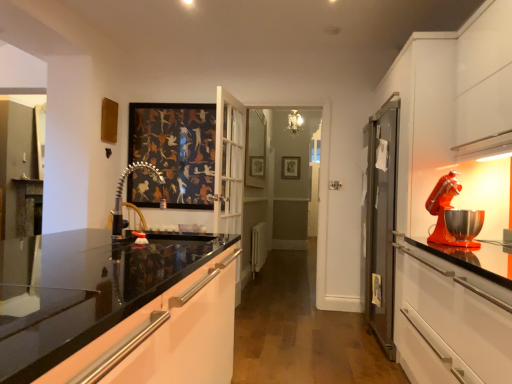
The height and width of the screenshot is (384, 512). Describe the element at coordinates (128, 202) in the screenshot. I see `polished chrome faucet at center` at that location.

Locate an element on the screen. This screenshot has height=384, width=512. white plastic radiator at center is located at coordinates point(258,247).

Find the location of a particular element. This screenshot has height=384, width=512. shiny orange mixer at right is located at coordinates (444, 212).

Between wooden picture frame at center and polished chrome faucet at center, which one has smaller size?

wooden picture frame at center is smaller.

Looking at this image, from the image's perspective, is wooden picture frame at center below polished chrome faucet at center?

No, from the image's perspective, wooden picture frame at center is not below polished chrome faucet at center.

Considering the relative sizes of wooden picture frame at center and polished chrome faucet at center in the image provided, is wooden picture frame at center wider than polished chrome faucet at center?

No.

Is wooden picture frame at center oriented away from polished chrome faucet at center?

wooden picture frame at center is not turned away from polished chrome faucet at center.

Where is `cabinetry that appears below the wooden picture frame at center (from the image's perspective)`? The image size is (512, 384). cabinetry that appears below the wooden picture frame at center (from the image's perspective) is located at coordinates (124, 311).

Which is more distant, (211,302) or (298,165)?

Positioned behind is point (298,165).

Are glossy white cabinet at center and wooden picture frame at center making contact?

No, glossy white cabinet at center is not making contact with wooden picture frame at center.

From the image's perspective, between glossy white cabinet at center and wooden picture frame at center, which one is located above?

wooden picture frame at center, from the image's perspective.

How many degrees apart are the facing directions of polished chrome faucet at center and glossy white cabinet at center?

There is a 0.945-degree angle between the facing directions of polished chrome faucet at center and glossy white cabinet at center.

Does polished chrome faucet at center come in front of glossy white cabinet at center?

No, polished chrome faucet at center is further to the viewer.

Choose the correct answer: Is polished chrome faucet at center inside glossy white cabinet at center or outside it?

The correct answer is: outside.

Which of these two, polished chrome faucet at center or glossy white cabinet at center, is bigger?

glossy white cabinet at center is bigger.

Is the depth of shiny orange mixer at right less than that of white plastic radiator at center?

Yes.

Based on their positions, is shiny orange mixer at right located to the left or right of white plastic radiator at center?

shiny orange mixer at right is positioned on white plastic radiator at center's right side.

Who is bigger, shiny orange mixer at right or white plastic radiator at center?

Bigger between the two is white plastic radiator at center.

How different are the orientations of shiny orange mixer at right and white plastic radiator at center in degrees?

There is a 162-degree angle between the facing directions of shiny orange mixer at right and white plastic radiator at center.

Is the surface of white plastic radiator at center in direct contact with shiny orange mixer at right?

No, white plastic radiator at center is not in contact with shiny orange mixer at right.

Is white plastic radiator at center oriented away from shiny orange mixer at right?

No, shiny orange mixer at right is not at the back of white plastic radiator at center.

Which is in front, white plastic radiator at center or shiny orange mixer at right?

shiny orange mixer at right is in front.

Is shiny orange mixer at right outside of polished chrome faucet at center?

Yes, shiny orange mixer at right is outside of polished chrome faucet at center.

How distant is shiny orange mixer at right from polished chrome faucet at center?

2.96 meters.

Which of these two, shiny orange mixer at right or polished chrome faucet at center, is smaller?

polished chrome faucet at center.

Could you tell me if shiny orange mixer at right is turned towards polished chrome faucet at center?

Yes, shiny orange mixer at right is facing polished chrome faucet at center.

From the image's perspective, which one is positioned higher, white plastic radiator at center or glossy white cabinet at center?

glossy white cabinet at center, from the image's perspective.

Considering the relative sizes of white plastic radiator at center and glossy white cabinet at center in the image provided, is white plastic radiator at center bigger than glossy white cabinet at center?

Answer: No, white plastic radiator at center is not bigger than glossy white cabinet at center.

How different are the orientations of white plastic radiator at center and glossy white cabinet at center in degrees?

There is a 2.08-degree angle between the facing directions of white plastic radiator at center and glossy white cabinet at center.

In the image, there is a wooden picture frame at center. At what (x,y) coordinates should I click in order to perform the action: click on faucet below it (from the image's perspective). Please return your answer as a coordinate pair (x, y). The width and height of the screenshot is (512, 384). Looking at the image, I should click on (128, 202).

Locate an element on the screen. The width and height of the screenshot is (512, 384). picture frame behind the glossy white cabinet at center is located at coordinates (290, 167).

Which object lies nearer to the anchor point wooden picture frame at center, glossy white cabinet at center or white plastic radiator at center?

white plastic radiator at center.

Looking at the image, which one is located closer to white plastic radiator at center, shiny orange mixer at right or wooden picture frame at center?

wooden picture frame at center is closer to white plastic radiator at center.

From the image, which object appears to be nearer to white plastic radiator at center, glossy white cabinet at center or polished chrome faucet at center?

polished chrome faucet at center is closer to white plastic radiator at center.

Based on their spatial positions, is glossy white cabinet at center or wooden picture frame at center further from shiny orange mixer at right?

wooden picture frame at center lies further to shiny orange mixer at right than the other object.

Estimate the real-world distances between objects in this image. Which object is further from shiny orange mixer at right, polished chrome faucet at center or white plastic radiator at center?

white plastic radiator at center is further to shiny orange mixer at right.

Which object lies nearer to the anchor point wooden picture frame at center, shiny orange mixer at right or white plastic radiator at center?

white plastic radiator at center.

Considering their positions, is shiny orange mixer at right positioned closer to glossy white cabinet at center than white plastic radiator at center?

white plastic radiator at center is positioned closer to the anchor glossy white cabinet at center.

From the image, which object appears to be nearer to white plastic radiator at center, polished chrome faucet at center or glossy white cabinet at center?

polished chrome faucet at center lies closer to white plastic radiator at center than the other object.

Identify the location of faucet positioned between glossy white cabinet at center and white plastic radiator at center from near to far. (128, 202).

Where is `appliance positioned between polished chrome faucet at center and wooden picture frame at center from near to far`? appliance positioned between polished chrome faucet at center and wooden picture frame at center from near to far is located at coordinates (258, 247).

You are a GUI agent. You are given a task and a screenshot of the screen. Output one action in this format:
    pyautogui.click(x=<x>, y=<y>)
    Task: Click on the faucet between glossy white cabinet at center and wooden picture frame at center in the front-back direction
    Image resolution: width=512 pixels, height=384 pixels.
    Given the screenshot: What is the action you would take?
    pyautogui.click(x=128, y=202)

This screenshot has height=384, width=512. In order to click on appliance between shiny orange mixer at right and wooden picture frame at center from front to back in this screenshot , I will do `click(258, 247)`.